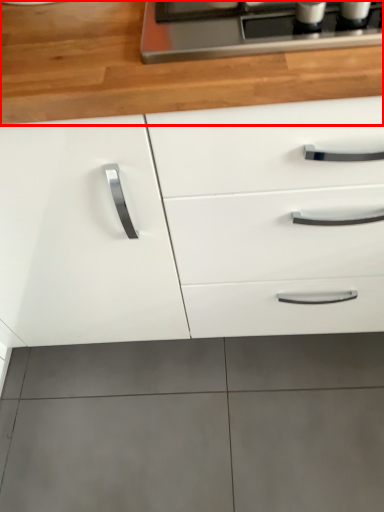
Question: From the image's perspective, where is countertop (annotated by the red box) located relative to cabinetry?

Choices:
 (A) below
 (B) above

Answer: (B)